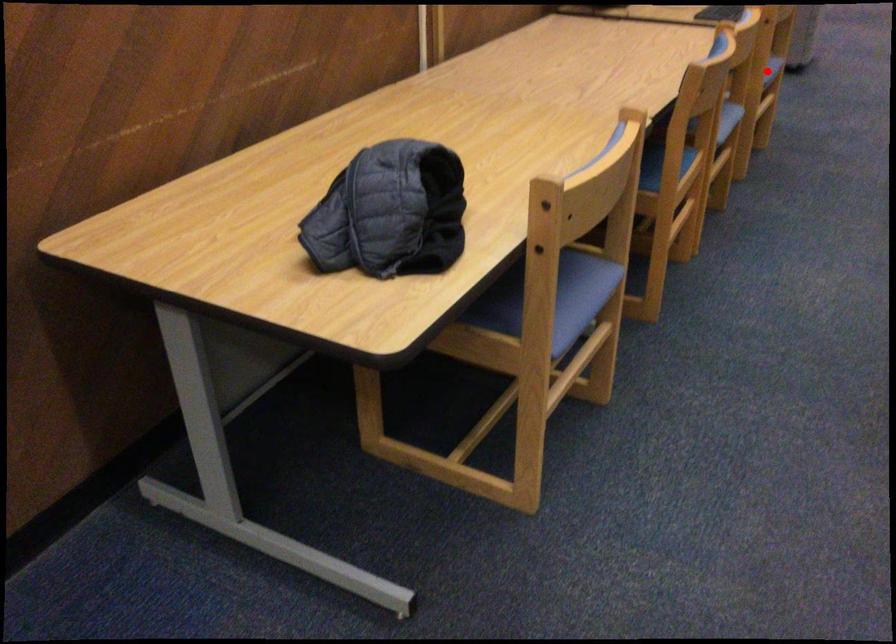
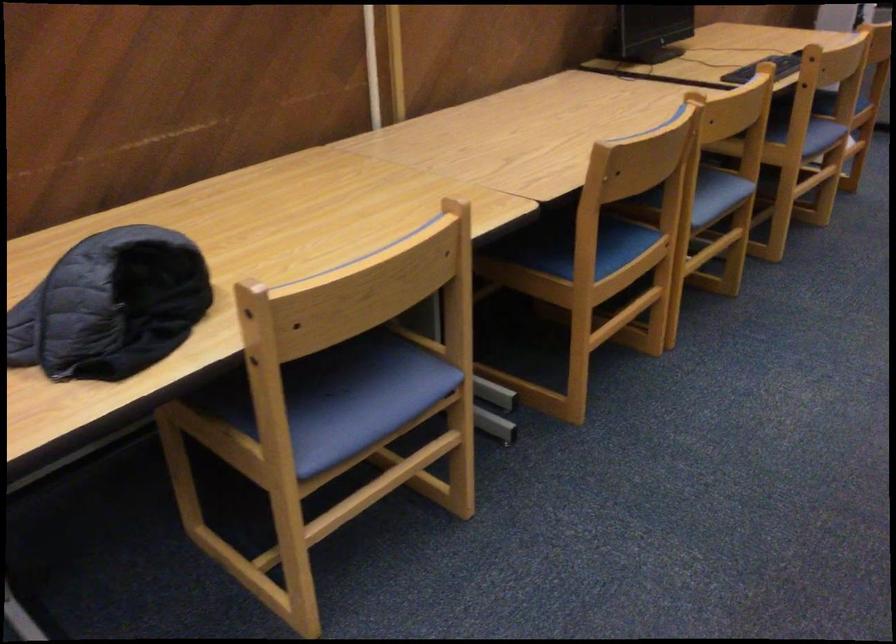
Where in the second image is the point corresponding to the highlighted location from the first image?

(821, 136)